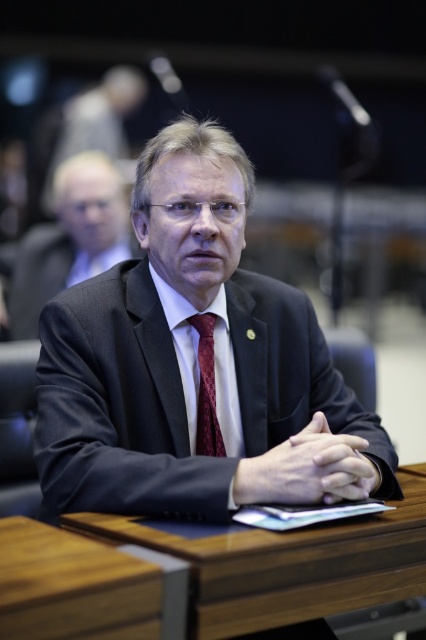
You are organizing a formal event and need to ensure that the attire of the speaker aligns with the theme. The speaker is wearing a dark blue suit at center and a burgundy woven tie at center. Based on their positioning, which item is more to the left?

The burgundy woven tie at center is more to the left since the dark blue suit at center is positioned on the right side of it.

You are standing in the conference room and want to determine which of the two points, point [362,497] or point [209,364], is nearer to you. Based on the image, which one is closer?

Point [362,497] is closer to the camera than point [209,364], so it is the nearer one.